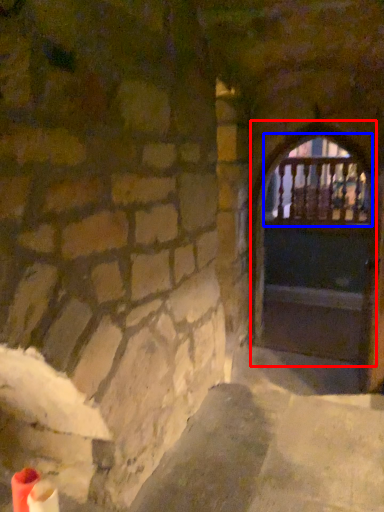
Question: Which point is further to the camera, door (highlighted by a red box) or window (highlighted by a blue box)?

Choices:
 (A) door
 (B) window

Answer: (B)